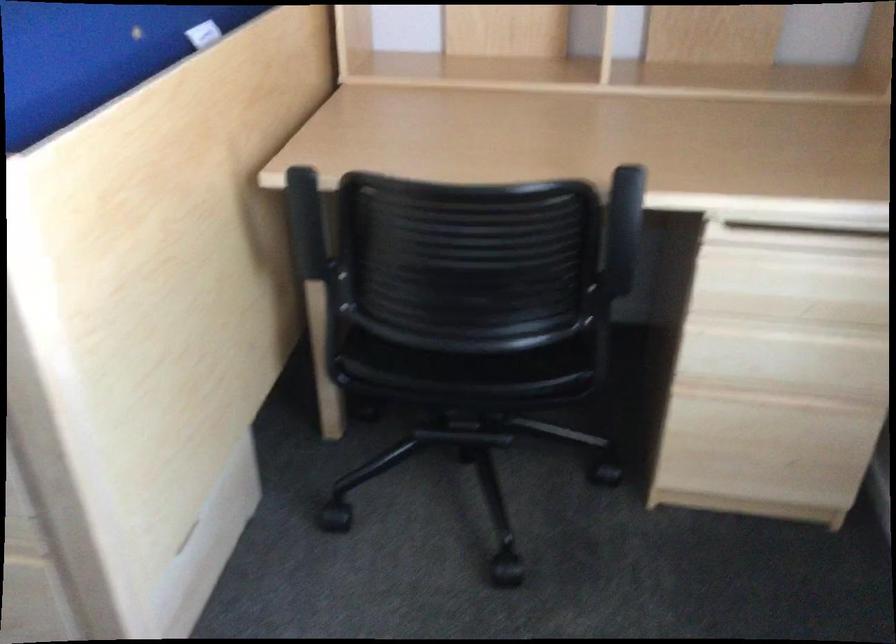
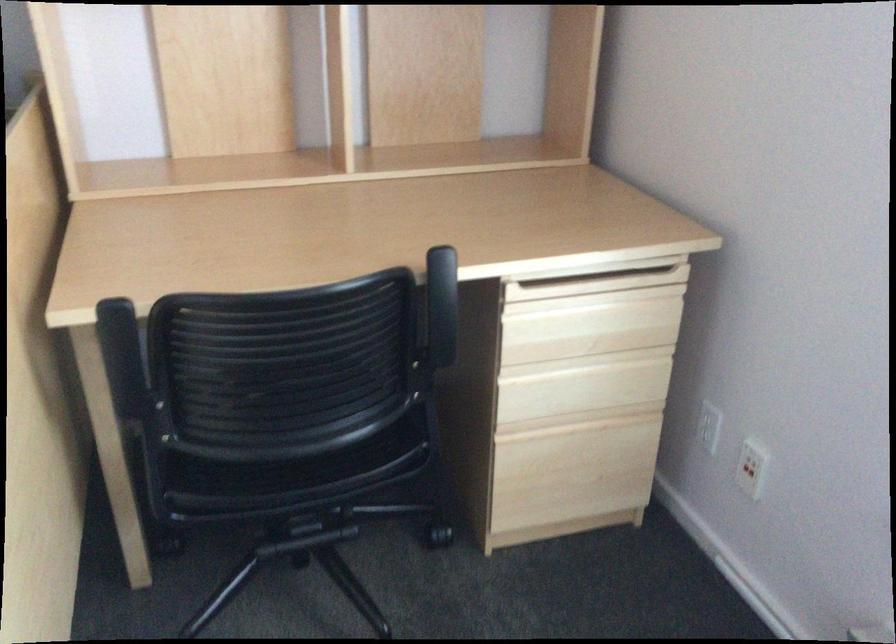
The point at (x=807, y=245) is marked in the first image. Where is the corresponding point in the second image?

(587, 286)